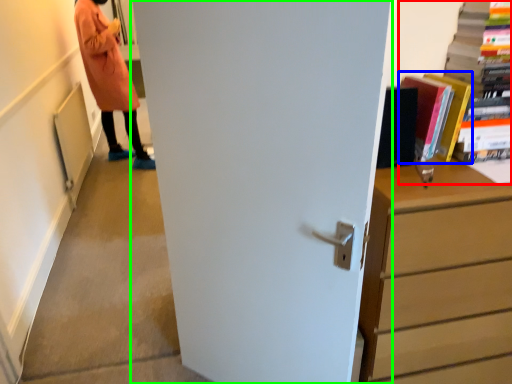
Question: Which object is the farthest from book (highlighted by a red box)? Choose among these: book (highlighted by a blue box) or door (highlighted by a green box).

Choices:
 (A) book
 (B) door

Answer: (B)